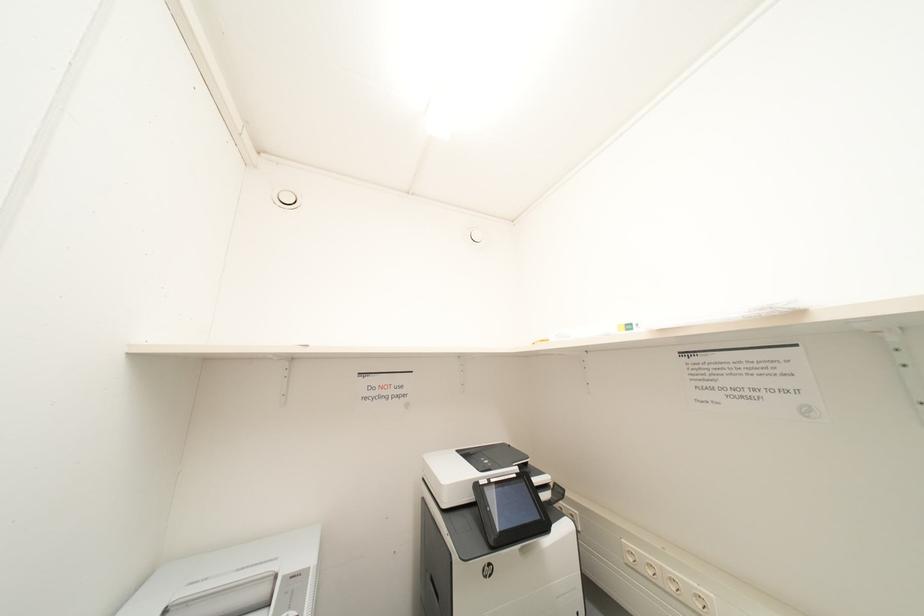
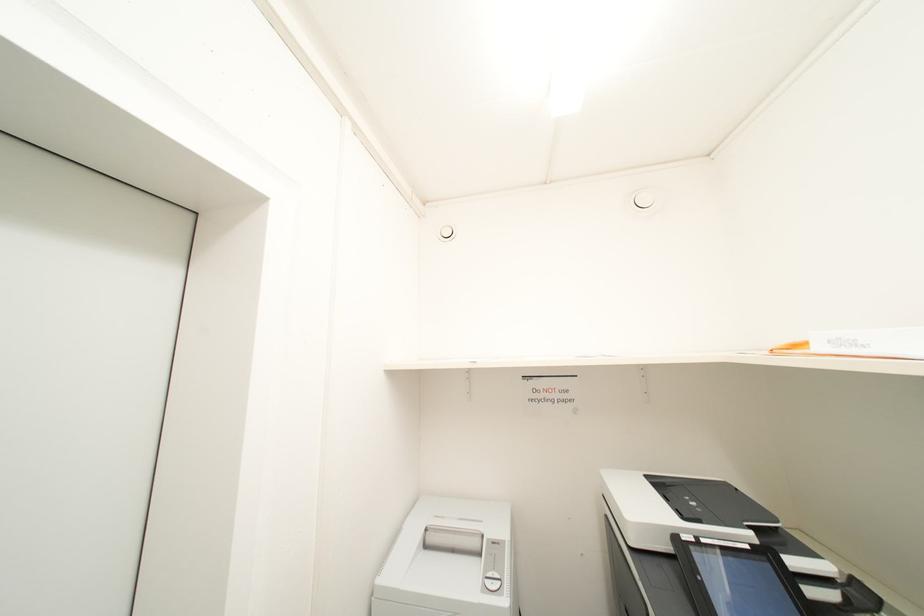
Question: How did the camera likely rotate?

Choices:
 (A) Left
 (B) Right
 (C) Up
 (D) Down

Answer: (A)